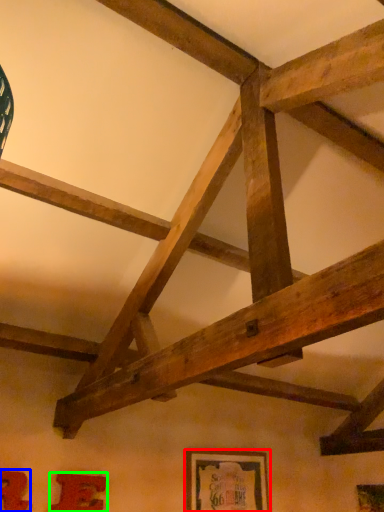
Question: Based on their relative distances, which object is farther from picture frame (highlighted by a red box)? Choose from picture frame (highlighted by a blue box) and picture frame (highlighted by a green box).

Choices:
 (A) picture frame
 (B) picture frame

Answer: (A)